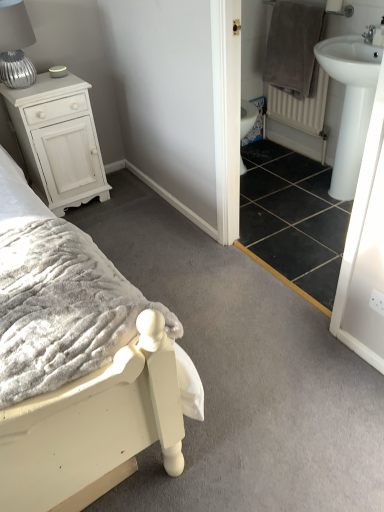
You are a GUI agent. You are given a task and a screenshot of the screen. Output one action in this format:
    pyautogui.click(x=<x>, y=<y>)
    Task: Click on the vacant space underneath gray plush towel at upper right (from a real-world perspective)
    Image resolution: width=384 pixels, height=512 pixels.
    Given the screenshot: What is the action you would take?
    pyautogui.click(x=280, y=154)